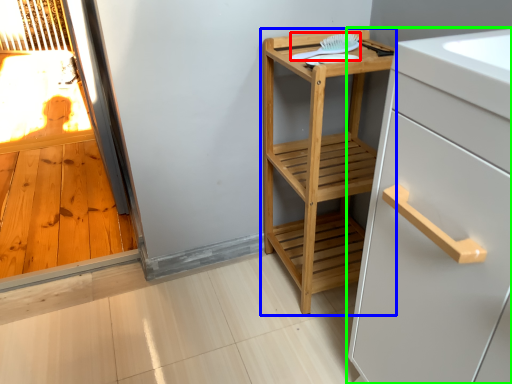
Question: Which object is the farthest from brush (highlighted by a red box)? Choose among these: furniture (highlighted by a blue box) or cabinetry (highlighted by a green box).

Choices:
 (A) furniture
 (B) cabinetry

Answer: (B)